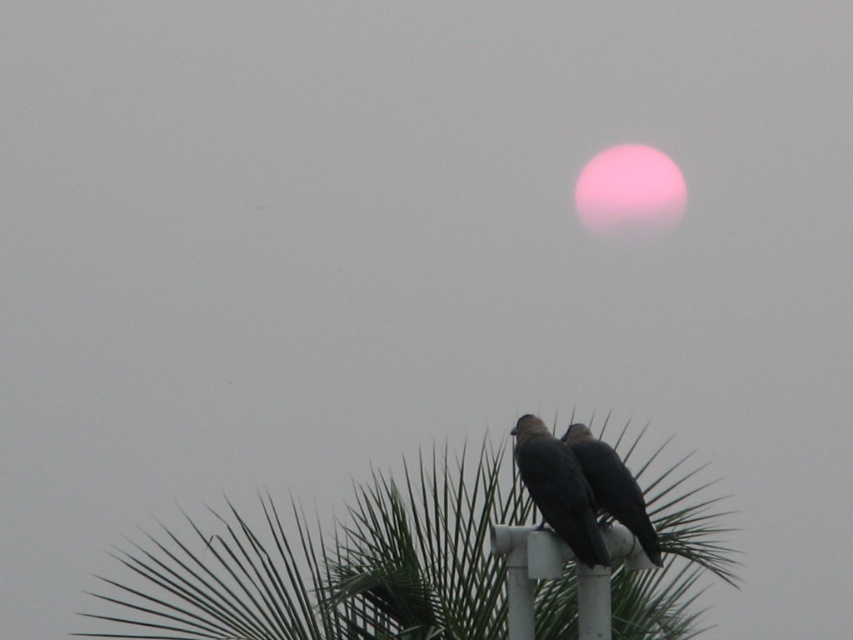
You are an ornithologist studying bird positions in the scene. Based on the coordinates provided, can you determine the exact location of the dark gray feathers at center?

The dark gray feathers at center are located at the 2D coordinates point (558, 490).